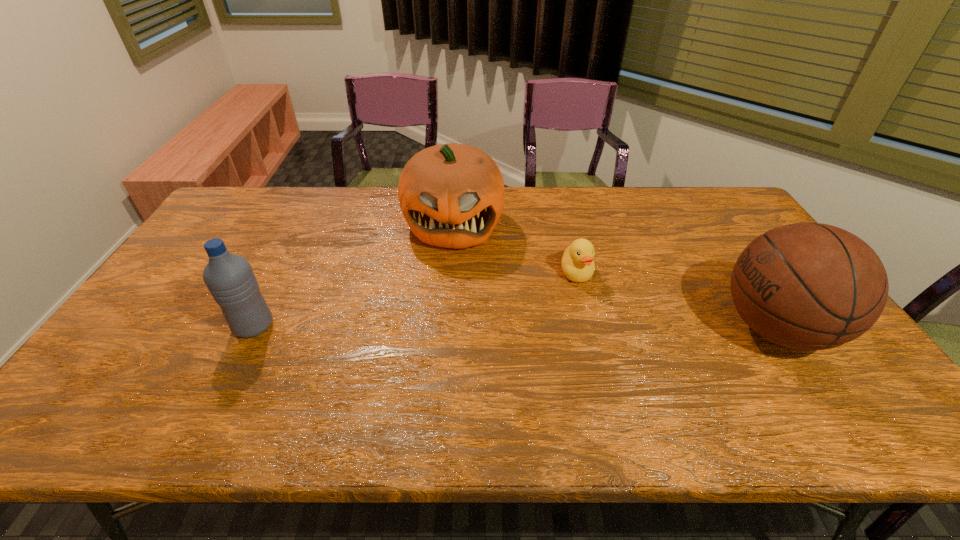
You are a GUI agent. You are given a task and a screenshot of the screen. Output one action in this format:
    pyautogui.click(x=<x>, y=<y>)
    Task: Click on the water bottle
    This screenshot has width=960, height=540.
    Given the screenshot: What is the action you would take?
    pyautogui.click(x=230, y=279)

I want to click on the rightmost object, so click(809, 286).

Image resolution: width=960 pixels, height=540 pixels. What are the coordinates of `duckling` in the screenshot? It's located at (577, 262).

At what (x,y) coordinates should I click in order to perform the action: click on the shortest object. Please return your answer as a coordinate pair (x, y). Looking at the image, I should click on (577, 262).

At what (x,y) coordinates should I click in order to perform the action: click on the farthest object. Please return your answer as a coordinate pair (x, y). This screenshot has width=960, height=540. Looking at the image, I should click on (451, 195).

Image resolution: width=960 pixels, height=540 pixels. Identify the location of pumpkin. (451, 195).

You are a GUI agent. You are given a task and a screenshot of the screen. Output one action in this format:
    pyautogui.click(x=<x>, y=<y>)
    Task: Click on the free space located 0.320m on the right of the water bottle
    The image size is (960, 540).
    Given the screenshot: What is the action you would take?
    pyautogui.click(x=395, y=326)

Locate an element on the screen. The height and width of the screenshot is (540, 960). free space located on the side with brand label of the rightmost object is located at coordinates (614, 328).

Locate an element on the screen. vacant area situated on the side with brand label of the rightmost object is located at coordinates [614, 328].

You are a GUI agent. You are given a task and a screenshot of the screen. Output one action in this format:
    pyautogui.click(x=<x>, y=<y>)
    Task: Click on the blank space located 0.400m on the side with brand label of the rightmost object
    The height and width of the screenshot is (540, 960).
    Given the screenshot: What is the action you would take?
    pyautogui.click(x=565, y=328)